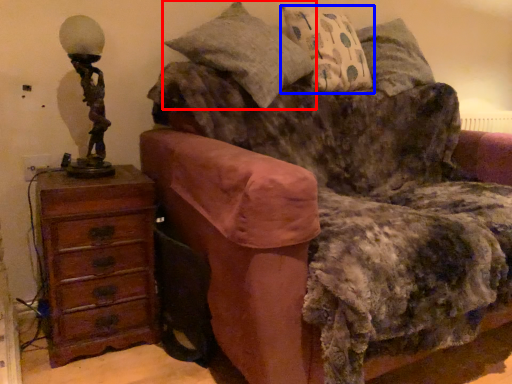
Question: Which point is further to the camera, pillow (highlighted by a red box) or pillow (highlighted by a blue box)?

Choices:
 (A) pillow
 (B) pillow

Answer: (B)